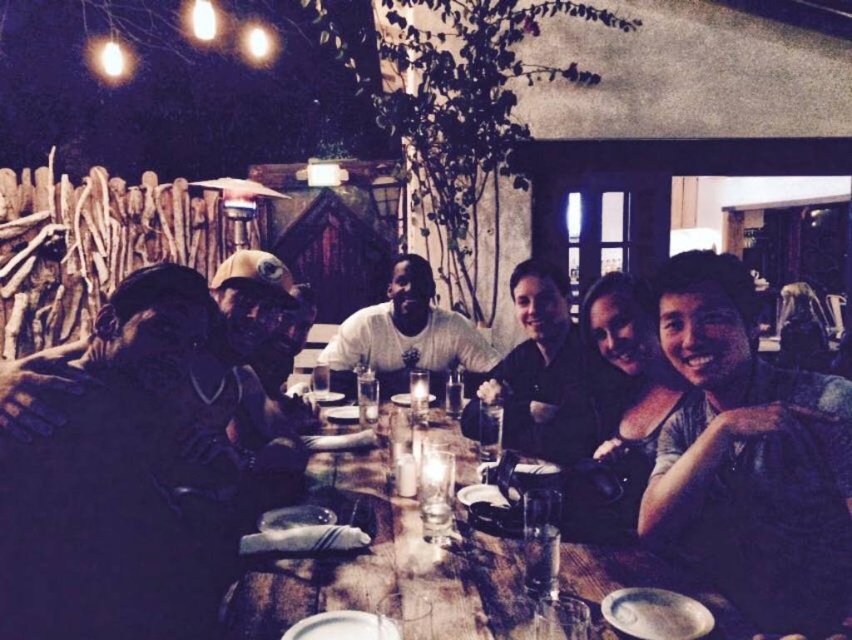
Question: Which point is closer to the camera taking this photo?

Choices:
 (A) (439, 548)
 (B) (60, 529)
 (C) (700, 452)
 (D) (464, 432)

Answer: (B)

Question: Is blue denim shirt at lower right closer to the viewer compared to white matte shirt at center?

Choices:
 (A) yes
 (B) no

Answer: (A)

Question: Which of the following is the closest to the observer?

Choices:
 (A) black matte shirt at center
 (B) dark matte jacket at left
 (C) blue denim shirt at lower right
 (D) white matte shirt at center

Answer: (B)

Question: Is blue denim shirt at lower right smaller than black matte shirt at center?

Choices:
 (A) yes
 (B) no

Answer: (B)

Question: Which of the following is the closest to the observer?

Choices:
 (A) (272, 625)
 (B) (684, 426)

Answer: (A)

Question: Is the position of black matte shirt at center more distant than that of white matte shirt at center?

Choices:
 (A) no
 (B) yes

Answer: (A)